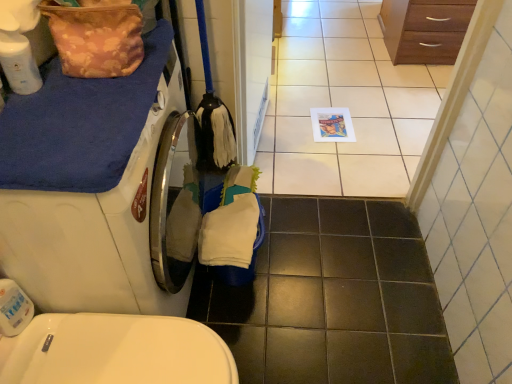
Question: Based on their sizes in the image, would you say white glossy tile at center is bigger or smaller than white glossy screen door at center?

Choices:
 (A) big
 (B) small

Answer: (A)

Question: Is white glossy tile at center spatially inside white glossy screen door at center, or outside of it?

Choices:
 (A) outside
 (B) inside

Answer: (A)

Question: Which is nearer to the white matte washing machine at left?

Choices:
 (A) floral fabric bag at upper left
 (B) wooden chest of drawers at upper right
 (C) white glossy screen door at center
 (D) white glossy tile at center

Answer: (A)

Question: Which is farther from the white matte washing machine at left?

Choices:
 (A) floral fabric bag at upper left
 (B) white glossy tile at center
 (C) white glossy screen door at center
 (D) wooden chest of drawers at upper right

Answer: (D)